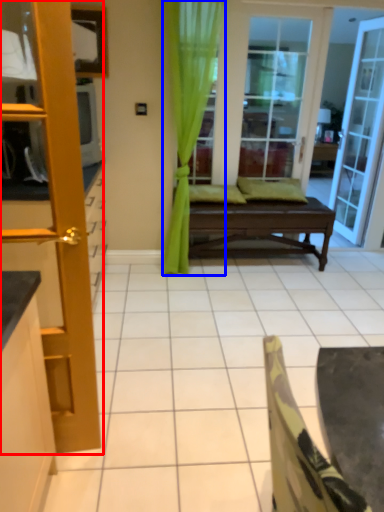
Question: Among these objects, which one is farthest to the camera, door (highlighted by a red box) or curtain (highlighted by a blue box)?

Choices:
 (A) door
 (B) curtain

Answer: (B)